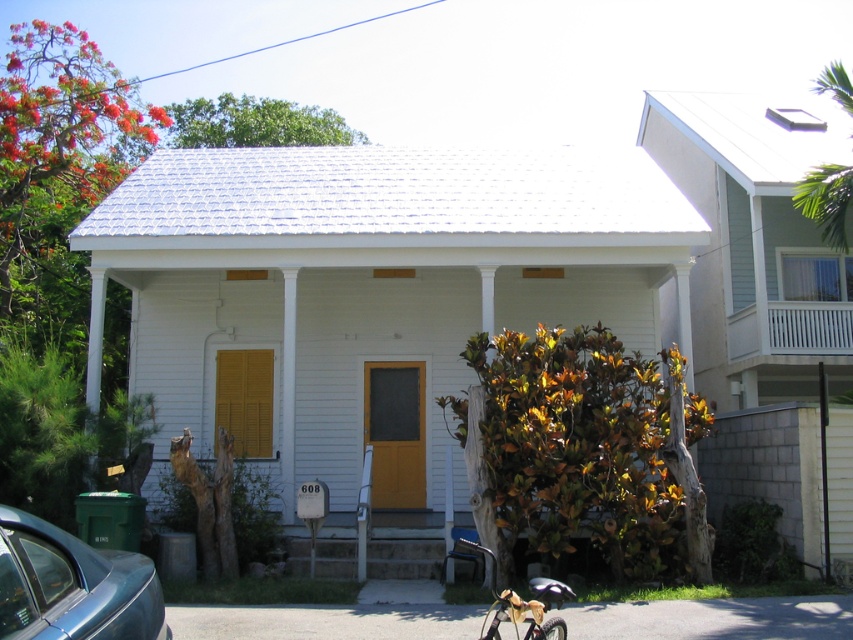
Based on the photo, is metallic blue car at lower left to the left of metallic gold bicycle at lower center from the viewer's perspective?

Indeed, metallic blue car at lower left is positioned on the left side of metallic gold bicycle at lower center.

Who is shorter, metallic blue car at lower left or metallic gold bicycle at lower center?

Standing shorter between the two is metallic gold bicycle at lower center.

Is point (22, 611) closer to viewer compared to point (566, 593)?

Yes, point (22, 611) is closer to viewer.

Find the location of a particular element. The height and width of the screenshot is (640, 853). metallic blue car at lower left is located at coordinates (73, 586).

Is metallic blue car at lower left wider than white painted wood porch at upper right?

In fact, metallic blue car at lower left might be narrower than white painted wood porch at upper right.

Can you confirm if metallic blue car at lower left is positioned below white painted wood porch at upper right?

Yes.

Locate an element on the screen. Image resolution: width=853 pixels, height=640 pixels. metallic blue car at lower left is located at coordinates (73, 586).

Is point (851, 321) less distant than point (515, 609)?

No, (851, 321) is further to viewer.

Can you confirm if white painted wood porch at upper right is thinner than metallic gold bicycle at lower center?

In fact, white painted wood porch at upper right might be wider than metallic gold bicycle at lower center.

The width and height of the screenshot is (853, 640). I want to click on white painted wood porch at upper right, so click(790, 328).